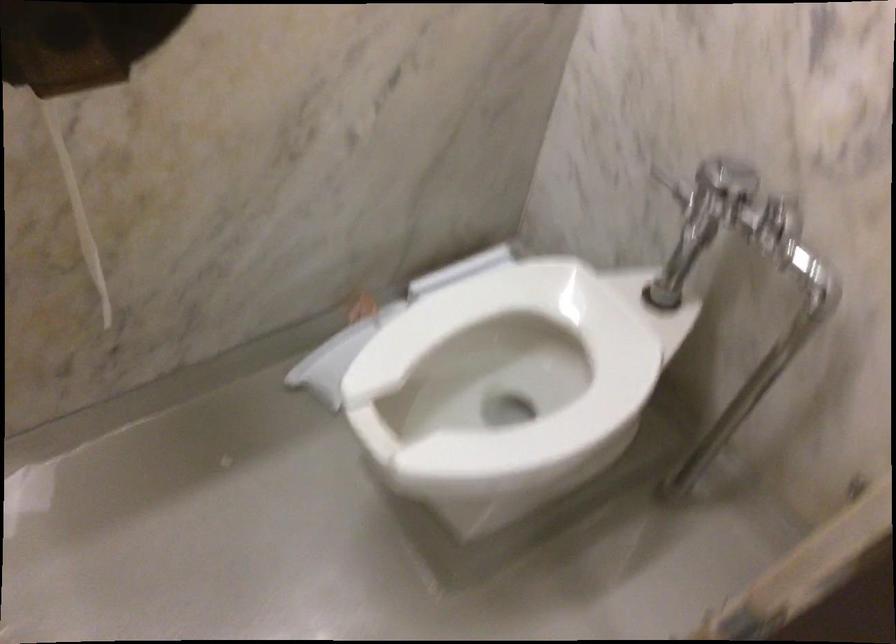
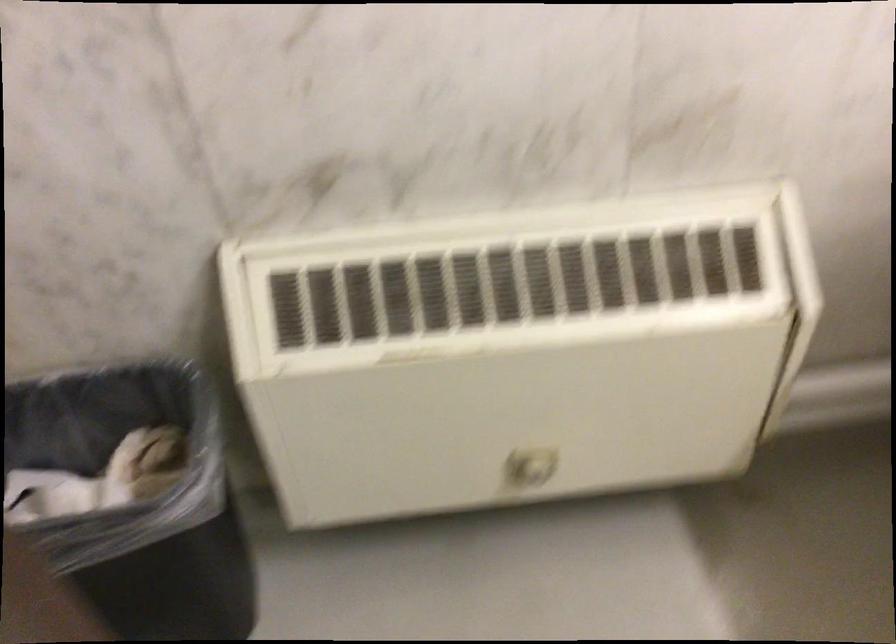
Question: The camera is either moving clockwise (left) or counter-clockwise (right) around the object. The first image is from the beginning of the video and the second image is from the end. Is the camera moving left or right when shooting the video?

Choices:
 (A) Left
 (B) Right

Answer: (A)